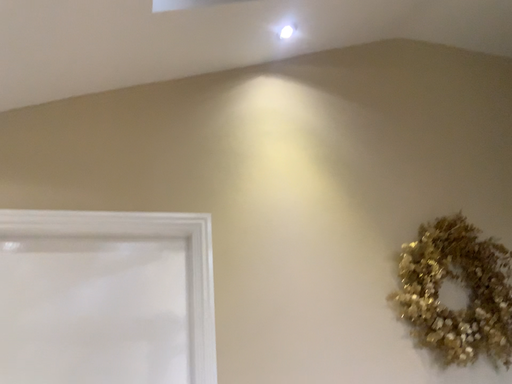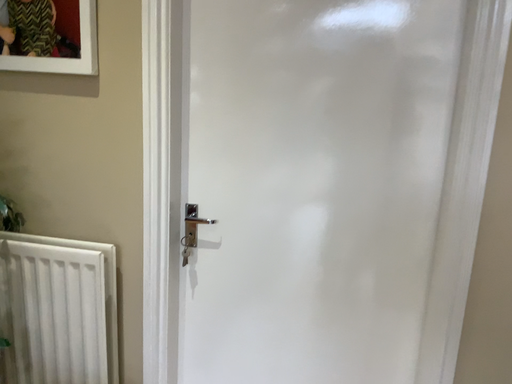
Question: How did the camera likely rotate when shooting the video?

Choices:
 (A) rotated right
 (B) rotated left

Answer: (B)